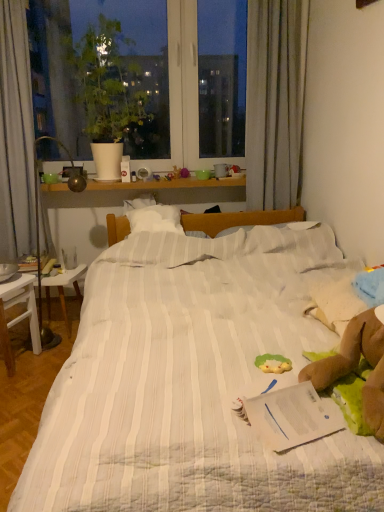
Where is `white paper at center`? white paper at center is located at coordinates [292, 416].

How much space does white wooden table at lower left, which appears as the first table when viewed from the front, occupy vertically?

white wooden table at lower left, which appears as the first table when viewed from the front, is 17.75 inches in height.

The width and height of the screenshot is (384, 512). What do you see at coordinates (19, 315) in the screenshot?
I see `white wooden table at lower left, which appears as the first table when viewed from the front` at bounding box center [19, 315].

The width and height of the screenshot is (384, 512). Identify the location of white paper at center. (292, 416).

Is green plush toy at center to the left of white paper at center from the viewer's perspective?

No, green plush toy at center is not to the left of white paper at center.

From a real-world perspective, does green plush toy at center stand above white paper at center?

No, from a real-world perspective, green plush toy at center is not on top of white paper at center.

Does point (279, 364) lie behind point (249, 421)?

Yes, point (279, 364) is behind point (249, 421).

Looking at this image, is white striped fabric bed at center not within green matte plant at upper left?

Yes, white striped fabric bed at center is not within green matte plant at upper left.

From a real-world perspective, is white striped fabric bed at center physically located above or below green matte plant at upper left?

Clearly, from a real-world perspective, white striped fabric bed at center is below green matte plant at upper left.

Between white striped fabric bed at center and green matte plant at upper left, which one has less height?

With less height is white striped fabric bed at center.

Considering the sizes of white striped fabric bed at center and green matte plant at upper left in the image, is white striped fabric bed at center bigger or smaller than green matte plant at upper left?

In the image, white striped fabric bed at center appears to be larger than green matte plant at upper left.

What's the angular difference between green plush toy at center and white striped fabric bed at center's facing directions?

There is a 90.4-degree angle between the facing directions of green plush toy at center and white striped fabric bed at center.

Considering their positions, is green plush toy at center located in front of or behind white striped fabric bed at center?

Clearly, green plush toy at center is behind white striped fabric bed at center.

From a real-world perspective, is green plush toy at center positioned above or below white striped fabric bed at center?

green plush toy at center is situated higher than white striped fabric bed at center in the real world.

Can you confirm if green plush toy at center is shorter than white striped fabric bed at center?

Yes, green plush toy at center is shorter than white striped fabric bed at center.

Could you measure the distance between green plush toy at center and white wooden table at left, the first table in the back-to-front sequence?

green plush toy at center is 1.63 meters away from white wooden table at left, the first table in the back-to-front sequence.

Is white wooden table at left, placed as the second table when sorted from front to back, a part of green plush toy at center?

Definitely not — white wooden table at left, placed as the second table when sorted from front to back, is not inside green plush toy at center.

Which of these two, green plush toy at center or white wooden table at left, placed as the second table when sorted from front to back, is bigger?

white wooden table at left, placed as the second table when sorted from front to back.

Does point (71, 273) come closer to viewer compared to point (2, 333)?

No.

Considering the relative sizes of white wooden table at left, placed as the second table when sorted from front to back, and white wooden table at lower left, which is the 2th table from back to front, in the image provided, is white wooden table at left, placed as the second table when sorted from front to back, shorter than white wooden table at lower left, which is the 2th table from back to front,?

Yes.

The image size is (384, 512). Find the location of `table that appears in front of the white wooden table at left, the first table in the back-to-front sequence`. table that appears in front of the white wooden table at left, the first table in the back-to-front sequence is located at coordinates (19, 315).

Can you tell me how much white wooden table at lower left, which appears as the first table when viewed from the front, and green plush toy at center differ in facing direction?

157 degrees separate the facing orientations of white wooden table at lower left, which appears as the first table when viewed from the front, and green plush toy at center.

In the scene shown: Is white wooden table at lower left, which appears as the first table when viewed from the front, outside of green plush toy at center?

Absolutely, white wooden table at lower left, which appears as the first table when viewed from the front, is external to green plush toy at center.

Does white wooden table at lower left, which is the 2th table from back to front, have a greater width compared to green plush toy at center?

Correct, the width of white wooden table at lower left, which is the 2th table from back to front, exceeds that of green plush toy at center.

Does white wooden table at lower left, which is the 2th table from back to front, have a smaller size compared to green plush toy at center?

No.

Would you say white paper at center is outside white wooden table at lower left, which appears as the first table when viewed from the front?

That's correct, white paper at center is outside of white wooden table at lower left, which appears as the first table when viewed from the front.

Is point (317, 426) positioned behind point (13, 369)?

No, (317, 426) is in front of (13, 369).

Looking at the image, does white paper at center seem bigger or smaller compared to white wooden table at lower left, which appears as the first table when viewed from the front?

Clearly, white paper at center is smaller in size than white wooden table at lower left, which appears as the first table when viewed from the front.

Does white paper at center lie behind white wooden table at lower left, which is the 2th table from back to front?

No, white paper at center is in front of white wooden table at lower left, which is the 2th table from back to front.

Locate an element on the screen. This screenshot has height=512, width=384. paperback book in front of the green plush toy at center is located at coordinates pos(292,416).

Locate an element on the screen. bed on the right of green matte plant at upper left is located at coordinates (187, 390).

Based on their spatial positions, is white wooden table at left, placed as the second table when sorted from front to back, or white striped fabric bed at center closer to green matte plant at upper left?

Among the two, white wooden table at left, placed as the second table when sorted from front to back, is located nearer to green matte plant at upper left.

When comparing their distances from white paper at center, does green plush toy at center or white wooden table at lower left, which is the 2th table from back to front, seem further?

white wooden table at lower left, which is the 2th table from back to front, is positioned further to the anchor white paper at center.

When comparing their distances from white wooden table at left, the first table in the back-to-front sequence, does green matte plant at upper left or white striped fabric bed at center seem closer?

green matte plant at upper left lies closer to white wooden table at left, the first table in the back-to-front sequence, than the other object.

Looking at the image, which one is located further to green plush toy at center, green matte plant at upper left or white wooden table at lower left, which is the 2th table from back to front?

The object further to green plush toy at center is green matte plant at upper left.

Considering their positions, is white paper at center positioned closer to green matte plant at upper left than white wooden table at lower left, which is the 2th table from back to front?

The object closer to green matte plant at upper left is white wooden table at lower left, which is the 2th table from back to front.

Based on their spatial positions, is white wooden table at left, the first table in the back-to-front sequence, or green plush toy at center further from green matte plant at upper left?

green plush toy at center.

Based on their spatial positions, is green plush toy at center or white striped fabric bed at center further from green matte plant at upper left?

Among the two, green plush toy at center is located further to green matte plant at upper left.

When comparing their distances from white wooden table at lower left, which is the 2th table from back to front, does white wooden table at left, placed as the second table when sorted from front to back, or white paper at center seem further?

Based on the image, white paper at center appears to be further to white wooden table at lower left, which is the 2th table from back to front.

Identify the location of paperback book between white striped fabric bed at center and green plush toy at center from front to back. Image resolution: width=384 pixels, height=512 pixels. (292, 416).

Where is `plant between white paper at center and white wooden table at left, the first table in the back-to-front sequence, along the z-axis`? The height and width of the screenshot is (512, 384). plant between white paper at center and white wooden table at left, the first table in the back-to-front sequence, along the z-axis is located at coordinates (107, 82).

Identify the location of table located between white striped fabric bed at center and white wooden table at left, placed as the second table when sorted from front to back, in the depth direction. The image size is (384, 512). (19, 315).

You are a GUI agent. You are given a task and a screenshot of the screen. Output one action in this format:
    pyautogui.click(x=<x>, y=<y>)
    Task: Click on the stuff between white paper at center and white wooden table at left, placed as the second table when sorted from front to back, along the z-axis
    The height and width of the screenshot is (512, 384).
    Given the screenshot: What is the action you would take?
    point(273,362)